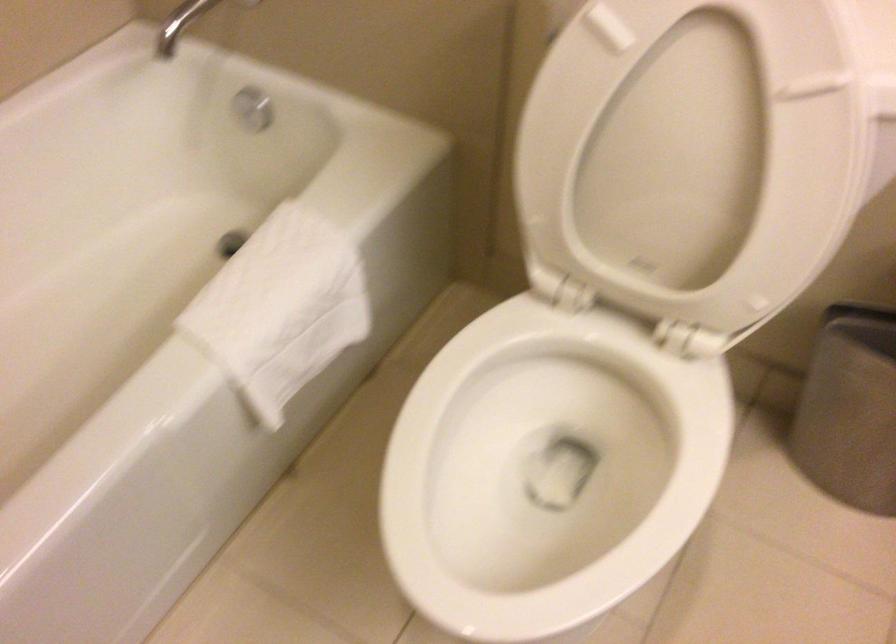
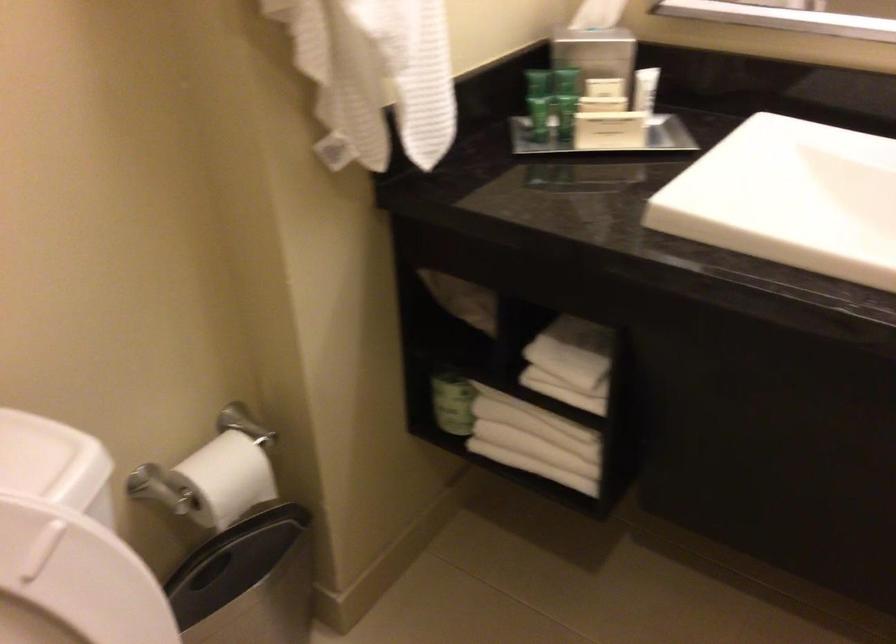
Locate, in the second image, the point that corresponds to point (798, 124) in the first image.

(73, 582)